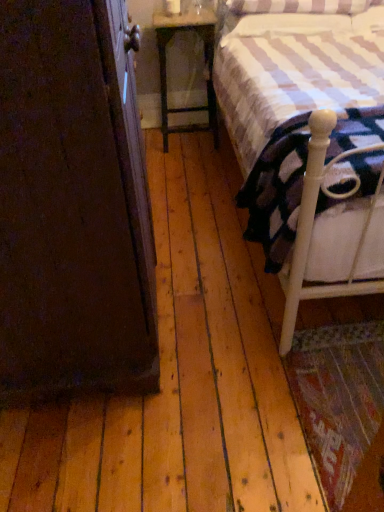
Question: Considering the relative sizes of white wood bed at right and wooden nightstand at center in the image provided, is white wood bed at right bigger than wooden nightstand at center?

Choices:
 (A) yes
 (B) no

Answer: (A)

Question: Is white wood bed at right smaller than wooden nightstand at center?

Choices:
 (A) no
 (B) yes

Answer: (A)

Question: Can you confirm if white wood bed at right is taller than wooden nightstand at center?

Choices:
 (A) yes
 (B) no

Answer: (A)

Question: Is white wood bed at right located outside wooden nightstand at center?

Choices:
 (A) yes
 (B) no

Answer: (A)

Question: Is wooden nightstand at center at the back of white wood bed at right?

Choices:
 (A) yes
 (B) no

Answer: (B)

Question: Choose the correct answer: Is white soft mattress at right inside white wood bed at right or outside it?

Choices:
 (A) inside
 (B) outside

Answer: (A)

Question: In terms of size, does white soft mattress at right appear bigger or smaller than white wood bed at right?

Choices:
 (A) small
 (B) big

Answer: (A)

Question: Looking at their shapes, would you say white soft mattress at right is wider or thinner than white wood bed at right?

Choices:
 (A) thin
 (B) wide

Answer: (A)

Question: From the image's perspective, is white soft mattress at right located above or below white wood bed at right?

Choices:
 (A) below
 (B) above

Answer: (A)

Question: Would you say white soft mattress at right is to the left or to the right of wooden nightstand at center in the picture?

Choices:
 (A) right
 (B) left

Answer: (A)

Question: Is white soft mattress at right inside or outside of wooden nightstand at center?

Choices:
 (A) inside
 (B) outside

Answer: (B)

Question: From the image's perspective, is white soft mattress at right located above or below wooden nightstand at center?

Choices:
 (A) below
 (B) above

Answer: (A)

Question: In terms of size, does white soft mattress at right appear bigger or smaller than wooden nightstand at center?

Choices:
 (A) small
 (B) big

Answer: (B)

Question: Would you say white soft mattress at right is inside or outside dark wood armoire at left?

Choices:
 (A) inside
 (B) outside

Answer: (B)

Question: Would you say white soft mattress at right is to the left or to the right of dark wood armoire at left in the picture?

Choices:
 (A) left
 (B) right

Answer: (B)